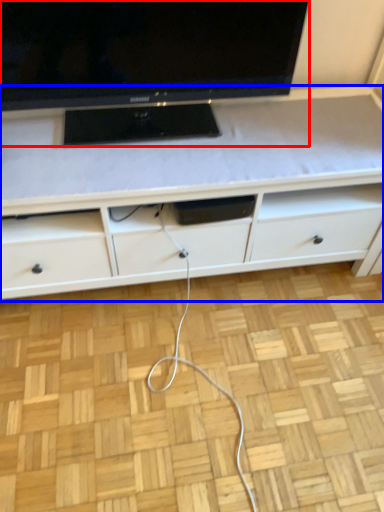
Question: Which object is further to the camera taking this photo, television (highlighted by a red box) or cabinetry (highlighted by a blue box)?

Choices:
 (A) television
 (B) cabinetry

Answer: (B)